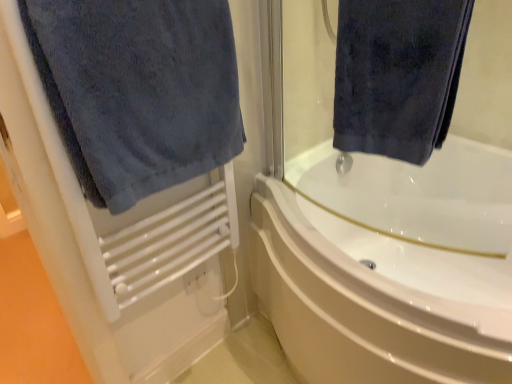
Question: From a real-world perspective, is white glossy bathtub at center on top of dark blue velvety towel at upper right, the second towel in the left-to-right sequence?

Choices:
 (A) no
 (B) yes

Answer: (A)

Question: From a real-world perspective, is white glossy bathtub at center located beneath dark blue velvety towel at upper right, the second towel in the left-to-right sequence?

Choices:
 (A) yes
 (B) no

Answer: (A)

Question: Is the surface of white glossy bathtub at center in direct contact with dark blue velvety towel at upper right, the second towel in the left-to-right sequence?

Choices:
 (A) no
 (B) yes

Answer: (A)

Question: Does white glossy bathtub at center have a lesser height compared to dark blue velvety towel at upper right, the second towel in the left-to-right sequence?

Choices:
 (A) yes
 (B) no

Answer: (B)

Question: Considering the relative sizes of white glossy bathtub at center and dark blue velvety towel at upper right, the first towel in the right-to-left sequence, in the image provided, is white glossy bathtub at center bigger than dark blue velvety towel at upper right, the first towel in the right-to-left sequence,?

Choices:
 (A) yes
 (B) no

Answer: (A)

Question: From the image's perspective, is white glossy bathtub at center located above or below dark blue velvety towel at upper right, the second towel in the left-to-right sequence?

Choices:
 (A) below
 (B) above

Answer: (A)

Question: Do you think white glossy bathtub at center is within dark blue velvety towel at upper right, the second towel in the left-to-right sequence, or outside of it?

Choices:
 (A) outside
 (B) inside

Answer: (A)

Question: Is white glossy bathtub at center in front of or behind dark blue velvety towel at upper right, the second towel in the left-to-right sequence, in the image?

Choices:
 (A) behind
 (B) front

Answer: (A)

Question: In the image, is white glossy bathtub at center on the left side or the right side of dark blue velvety towel at upper right, the first towel in the right-to-left sequence?

Choices:
 (A) right
 (B) left

Answer: (A)

Question: Considering the positions of white glossy bathtub at center and dark blue towel at left, which is counted as the 1th towel, starting from the left, in the image, is white glossy bathtub at center taller or shorter than dark blue towel at left, which is counted as the 1th towel, starting from the left,?

Choices:
 (A) tall
 (B) short

Answer: (A)

Question: Is white glossy bathtub at center situated inside dark blue towel at left, which is counted as the 1th towel, starting from the left, or outside?

Choices:
 (A) inside
 (B) outside

Answer: (B)

Question: In the image, is white glossy bathtub at center positioned in front of or behind dark blue towel at left, which is counted as the 1th towel, starting from the left?

Choices:
 (A) front
 (B) behind

Answer: (B)

Question: Is white glossy bathtub at center to the left or to the right of dark blue towel at left, arranged as the 2th towel when viewed from the right, in the image?

Choices:
 (A) right
 (B) left

Answer: (A)

Question: Is point (452, 48) closer or farther from the camera than point (161, 29)?

Choices:
 (A) farther
 (B) closer

Answer: (B)

Question: In the image, is dark blue velvety towel at upper right, the second towel in the left-to-right sequence, positioned in front of or behind dark blue towel at left, which is counted as the 1th towel, starting from the left?

Choices:
 (A) behind
 (B) front

Answer: (A)